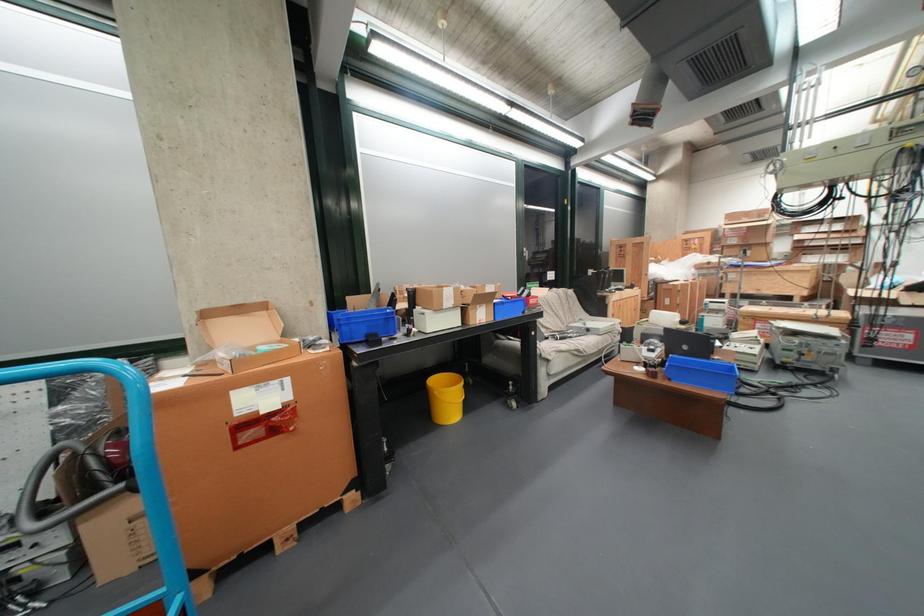
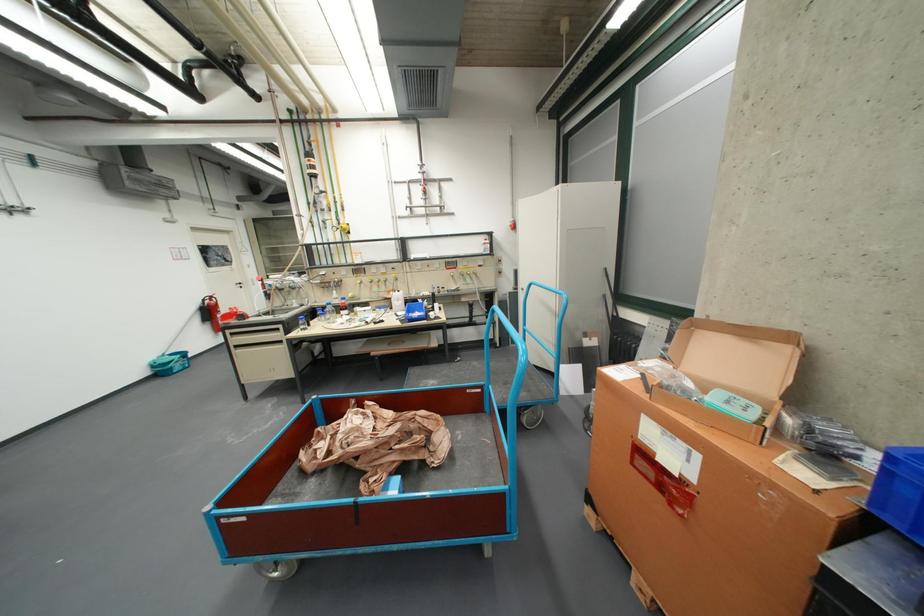
The first image is from the beginning of the video and the second image is from the end. How did the camera likely rotate when shooting the video?

The rotation direction of the camera is left-down.